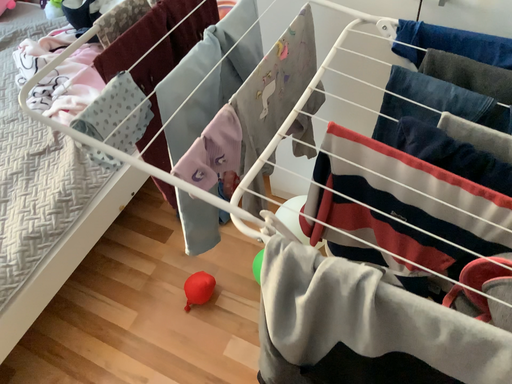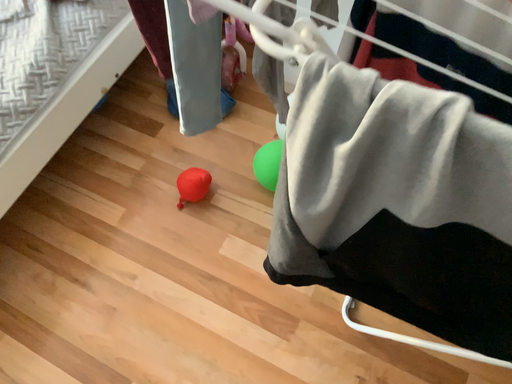
Question: Which way did the camera rotate in the video?

Choices:
 (A) rotated upward
 (B) rotated downward

Answer: (B)